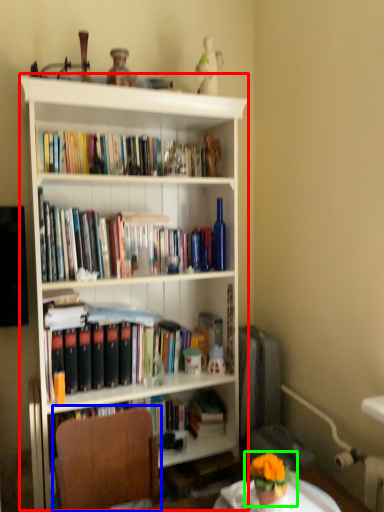
Question: Which object is the closest to the bookcase (highlighted by a red box)? Choose among these: chair (highlighted by a blue box) or houseplant (highlighted by a green box).

Choices:
 (A) chair
 (B) houseplant

Answer: (A)